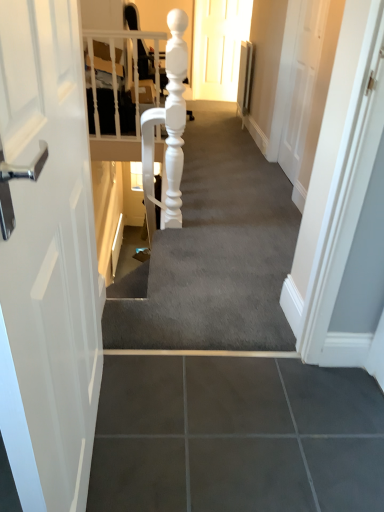
Question: In the image, is matte white door at upper center positioned in front of or behind smooth gray carpet at center?

Choices:
 (A) front
 (B) behind

Answer: (B)

Question: From the image's perspective, is matte white door at upper center located above or below smooth gray carpet at center?

Choices:
 (A) below
 (B) above

Answer: (B)

Question: Is matte white door at upper center inside or outside of smooth gray carpet at center?

Choices:
 (A) inside
 (B) outside

Answer: (B)

Question: Considering the positions of smooth gray carpet at center and matte white door at upper center in the image, is smooth gray carpet at center bigger or smaller than matte white door at upper center?

Choices:
 (A) big
 (B) small

Answer: (A)

Question: From the image's perspective, relative to matte white door at upper center, is smooth gray carpet at center above or below?

Choices:
 (A) below
 (B) above

Answer: (A)

Question: Considering their positions, is smooth gray carpet at center located in front of or behind matte white door at upper center?

Choices:
 (A) behind
 (B) front

Answer: (B)

Question: Considering the positions of smooth gray carpet at center and matte white door at upper center in the image, is smooth gray carpet at center taller or shorter than matte white door at upper center?

Choices:
 (A) short
 (B) tall

Answer: (A)